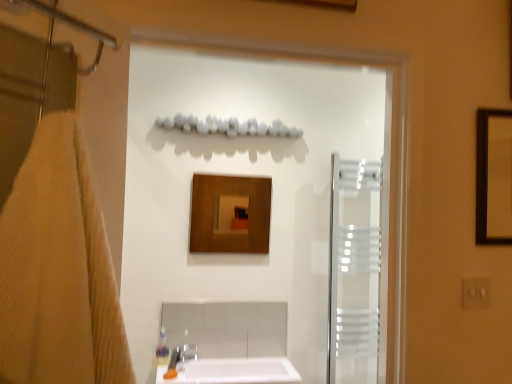
Question: From a real-world perspective, is wooden mirror at center above or below transparent glass screen door at center, which is the second screen door from right to left?

Choices:
 (A) above
 (B) below

Answer: (B)

Question: From the image's perspective, is wooden mirror at center above or below transparent glass screen door at center, the 1th screen door when ordered from front to back?

Choices:
 (A) below
 (B) above

Answer: (A)

Question: Which is nearer to the wooden mirror at center?

Choices:
 (A) translucent frosted glass screen door at right, acting as the second screen door starting from the front
 (B) transparent glass screen door at center, the 1th screen door when ordered from front to back
 (C) beige textured towel at left
 (D) white glossy sink at lower center

Answer: (B)

Question: Which object is positioned farthest from the transparent glass screen door at center, which is the second screen door from right to left?

Choices:
 (A) beige textured towel at left
 (B) wooden mirror at center
 (C) white glossy sink at lower center
 (D) translucent frosted glass screen door at right, acting as the second screen door starting from the front

Answer: (A)